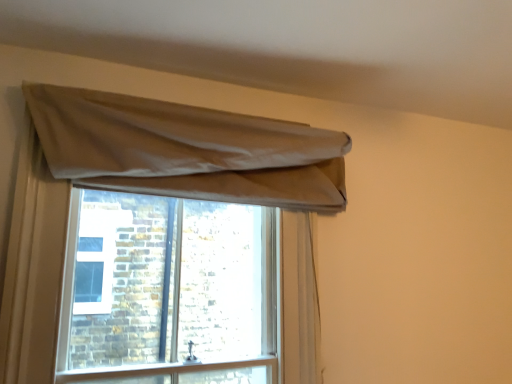
What do you see at coordinates (189, 149) in the screenshot? The image size is (512, 384). I see `beige fabric valance at upper center` at bounding box center [189, 149].

Identify the location of beige fabric valance at upper center. The width and height of the screenshot is (512, 384). (189, 149).

Measure the distance between point (77, 99) and camera.

The distance of point (77, 99) from camera is 3.87 feet.

I want to click on beige fabric valance at upper center, so click(189, 149).